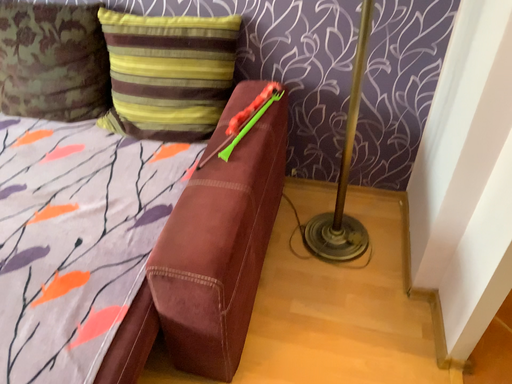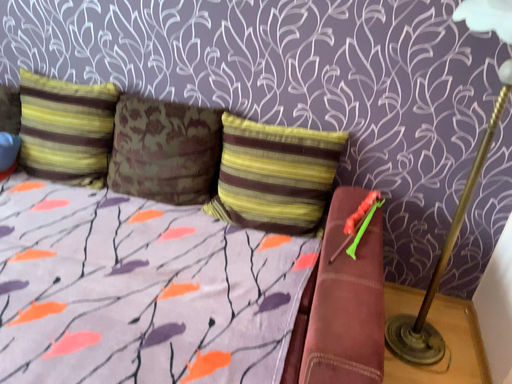
Question: How did the camera likely rotate when shooting the video?

Choices:
 (A) rotated downward
 (B) rotated upward

Answer: (B)